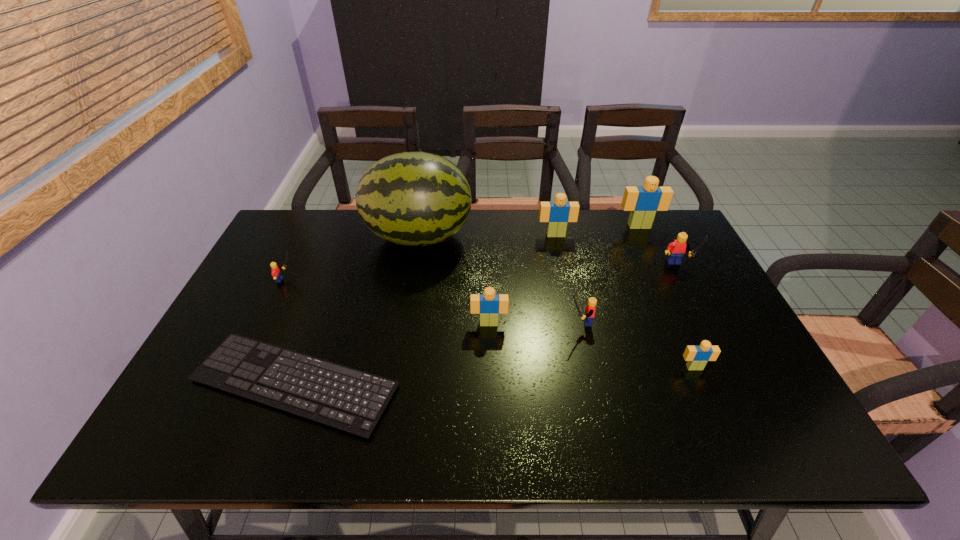
Locate an element on the screen. Lego at the left edge is located at coordinates (276, 273).

This screenshot has height=540, width=960. I want to click on computer keyboard located at the left edge, so click(x=345, y=398).

Where is `object located in the near left corner section of the desktop`? object located in the near left corner section of the desktop is located at coordinates (345, 398).

What are the coordinates of `object that is at the far right corner` in the screenshot? It's located at (643, 201).

Find the location of a particular element. Image resolution: width=960 pixels, height=540 pixels. free space at the far edge of the desktop is located at coordinates (583, 238).

Where is `vacant point at the near edge`? The height and width of the screenshot is (540, 960). vacant point at the near edge is located at coordinates (703, 437).

In the image, there is a desktop. Identify the location of free region at the right edge. This screenshot has height=540, width=960. (753, 362).

The width and height of the screenshot is (960, 540). In the image, there is a desktop. In order to click on free space at the far left corner in this screenshot , I will do `click(286, 251)`.

The width and height of the screenshot is (960, 540). In order to click on vacant position at the far right corner of the desktop in this screenshot , I will do `click(650, 241)`.

Find the location of a particular element. The height and width of the screenshot is (540, 960). vacant region at the near right corner of the desktop is located at coordinates (766, 415).